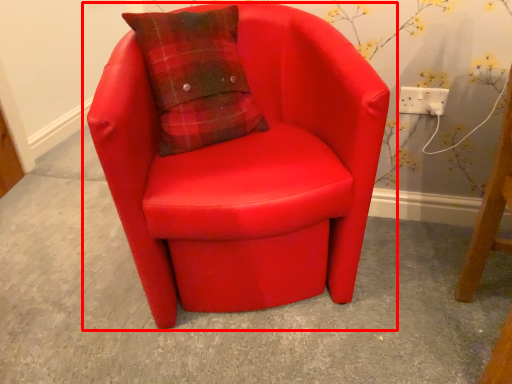
Question: From the image's perspective, what is the correct spatial positioning of chair (annotated by the red box) in reference to electric outlet?

Choices:
 (A) below
 (B) above

Answer: (A)